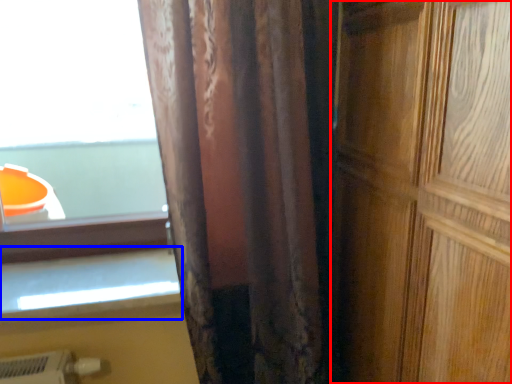
Question: Which point is closer to the camera, door (highlighted by a red box) or window sill (highlighted by a blue box)?

Choices:
 (A) door
 (B) window sill

Answer: (A)